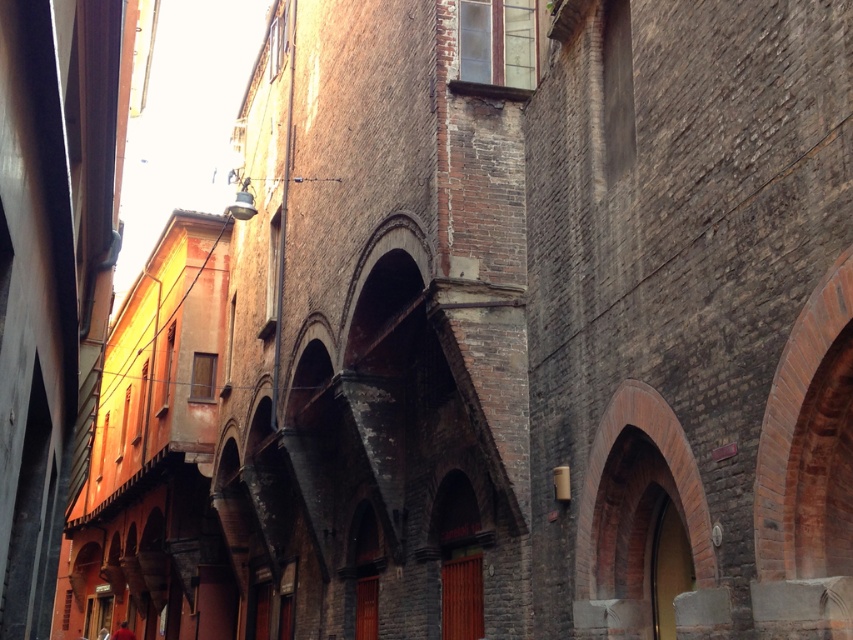
Is brick textured archway at center to the left of red cloth at lower left from the viewer's perspective?

No, brick textured archway at center is not to the left of red cloth at lower left.

Who is positioned more to the left, brick textured archway at center or red cloth at lower left?

Positioned to the left is red cloth at lower left.

Is point (704, 563) positioned before point (125, 634)?

Yes, point (704, 563) is closer to viewer.

Locate an element on the screen. The image size is (853, 640). brick textured archway at center is located at coordinates (666, 464).